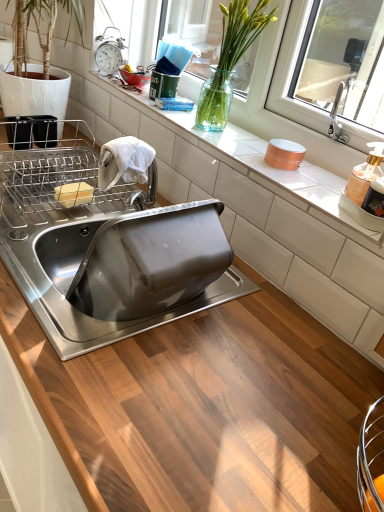
This screenshot has height=512, width=384. In order to click on blank space to the left of yellow butter at upper left in this screenshot , I will do `click(22, 184)`.